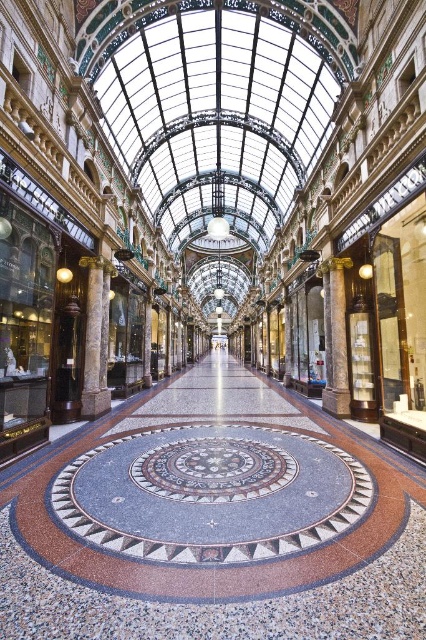
Is marble mosaic floor at center thinner than marble column at center?

No.

Between marble mosaic floor at center and marble column at center, which one is positioned lower?

marble mosaic floor at center is below.

Where is `marble mosaic floor at center`? The width and height of the screenshot is (426, 640). marble mosaic floor at center is located at coordinates (210, 493).

Image resolution: width=426 pixels, height=640 pixels. I want to click on marble mosaic floor at center, so click(x=210, y=493).

Is marble column at left wider than marble column at center?

Yes, marble column at left is wider than marble column at center.

Looking at this image, who is positioned more to the left, marble column at left or marble column at center?

marble column at left is more to the left.

Between point (83, 413) and point (331, 333), which one is positioned behind?

Positioned behind is point (331, 333).

The image size is (426, 640). Find the location of `marble column at left`. marble column at left is located at coordinates (95, 339).

Who is higher up, marble mosaic floor at center or marble column at left?

marble column at left

Is marble mosaic floor at center to the left of marble column at left from the viewer's perspective?

Incorrect, marble mosaic floor at center is not on the left side of marble column at left.

Is point (115, 484) in front of point (100, 403)?

Yes.

The height and width of the screenshot is (640, 426). I want to click on marble mosaic floor at center, so pos(210,493).